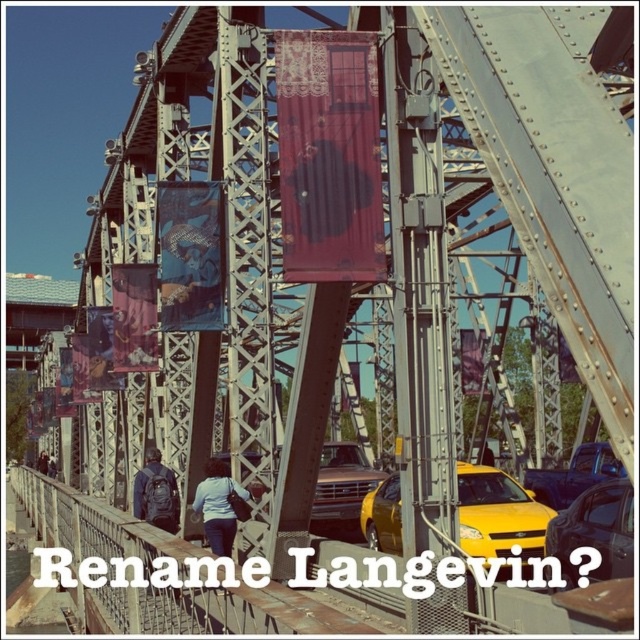
Question: Which point is farther to the camera?

Choices:
 (A) (323, 506)
 (B) (227, 509)
 (C) (161, 468)
 (D) (611, 509)

Answer: (A)

Question: Which point is farther from the camera taking this photo?

Choices:
 (A) (45, 456)
 (B) (349, 493)
 (C) (586, 529)

Answer: (A)

Question: Can you confirm if blue denim jeans at center is thinner than brown leather backpack at center?

Choices:
 (A) no
 (B) yes

Answer: (A)

Question: Can you confirm if metallic blue truck at center is wider than matte black backpack at lower left?

Choices:
 (A) yes
 (B) no

Answer: (B)

Question: Which of the following is the farthest from the observer?

Choices:
 (A) matte black backpack at lower left
 (B) yellow matte car at center

Answer: (A)

Question: Is yellow matte car at center closer to the viewer compared to dark gray backpack at center?

Choices:
 (A) no
 (B) yes

Answer: (B)